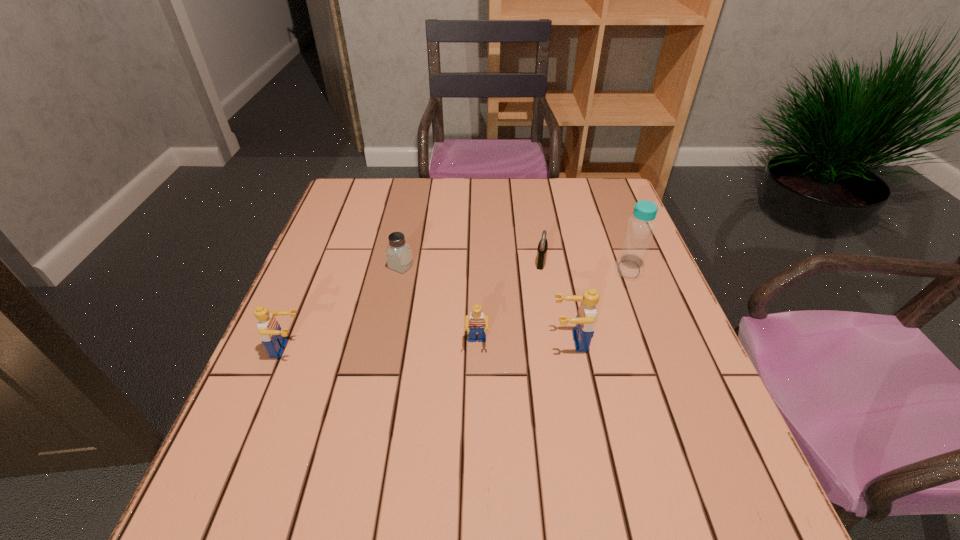
To achieve even spacing by inserting another Lego among them, please point to a vacant spot for this new Lego. Please provide its 2D coordinates. Your answer should be formatted as a tuple, i.e. [(x, y)], where the tuple contains the x and y coordinates of a point satisfying the conditions above.

[(383, 347)]